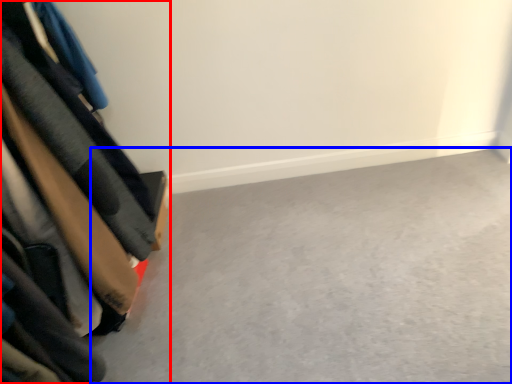
Question: Which object appears closest to the camera in this image, furniture (highlighted by a red box) or concrete (highlighted by a blue box)?

Choices:
 (A) furniture
 (B) concrete

Answer: (A)